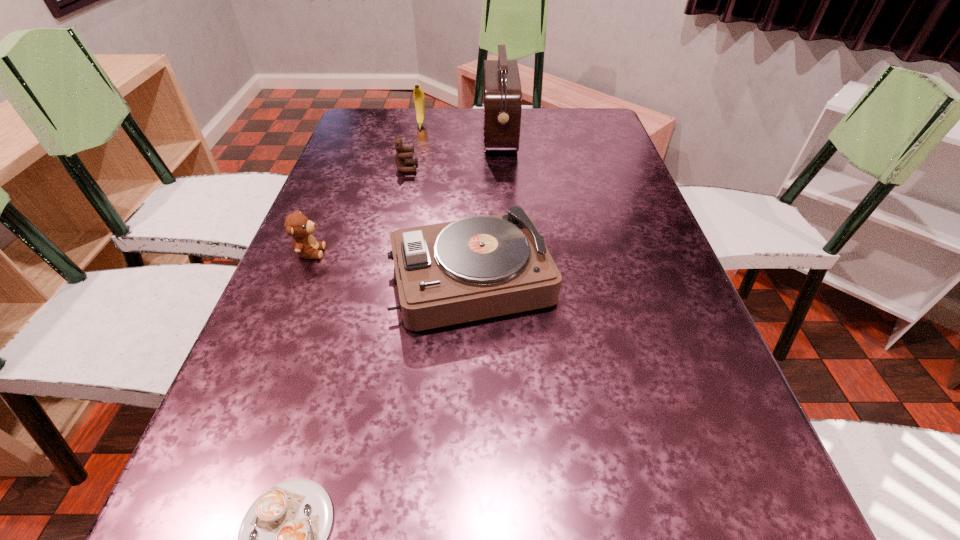
Image resolution: width=960 pixels, height=540 pixels. What are the coordinates of `vacant region that satisfies the following two spatial constraints: 1. on the face of the right teddy bear; 2. on the left side of the record player` in the screenshot? It's located at (382, 280).